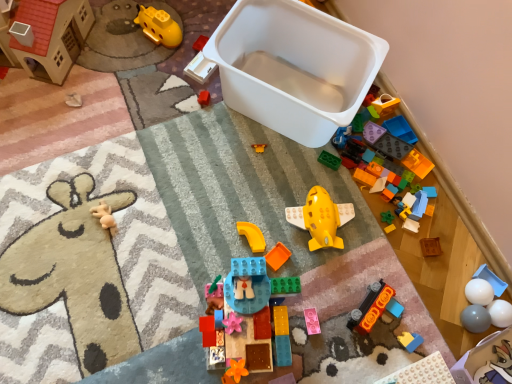
The height and width of the screenshot is (384, 512). I want to click on free space between yellow plastic submarine at upper left, which ranks as the fourteenth toy in right-to-left order, and orange matte car at lower right, marked as the 9th toy in a left-to-right arrangement, so click(x=248, y=156).